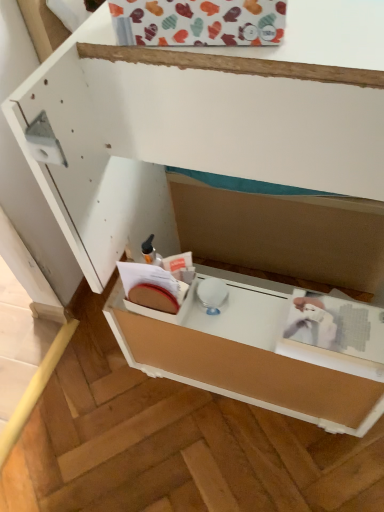
Locate an element on the screen. free location to the right of patterned cardboard box at upper center is located at coordinates (334, 30).